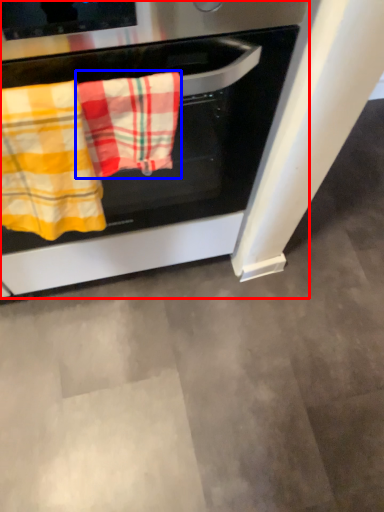
Question: Which point is closer to the camera, oven (highlighted by a red box) or beach towel (highlighted by a blue box)?

Choices:
 (A) oven
 (B) beach towel

Answer: (A)